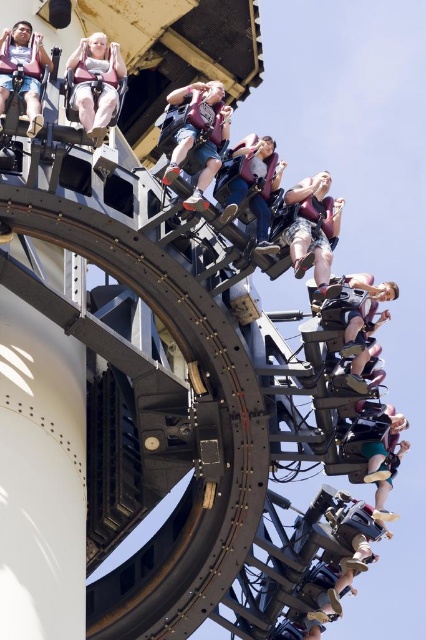
Identify the location of pink fabric seat at upper left. (95, 83).

Which of these two, pink fabric seat at upper left or matte black harness at center, stands taller?

matte black harness at center is taller.

Does point (114, 100) come in front of point (373, 316)?

Yes, point (114, 100) is in front of point (373, 316).

Image resolution: width=426 pixels, height=640 pixels. Identify the location of pink fabric seat at upper left. (95, 83).

Does pink fabric seat at upper left have a lesser height compared to matte black helmet at center?

In fact, pink fabric seat at upper left may be taller than matte black helmet at center.

Consider the image. Can you confirm if pink fabric seat at upper left is bigger than matte black helmet at center?

Actually, pink fabric seat at upper left might be smaller than matte black helmet at center.

Who is more distant from viewer, (81, 102) or (264, 237)?

Positioned behind is point (264, 237).

The image size is (426, 640). Find the location of `pink fabric seat at upper left`. pink fabric seat at upper left is located at coordinates (95, 83).

Between point (271, 166) and point (46, 52), which one is positioned behind?

The point (271, 166) is behind.

Who is more forward, (244,163) or (29,84)?

Point (29,84) is more forward.

Between point (265, 234) and point (3, 68), which one is positioned behind?

Point (265, 234)

At what (x,y) coordinates should I click in order to perform the action: click on matte black helmet at center. Please return your answer as a coordinate pair (x, y). Image resolution: width=426 pixels, height=640 pixels. Looking at the image, I should click on (252, 182).